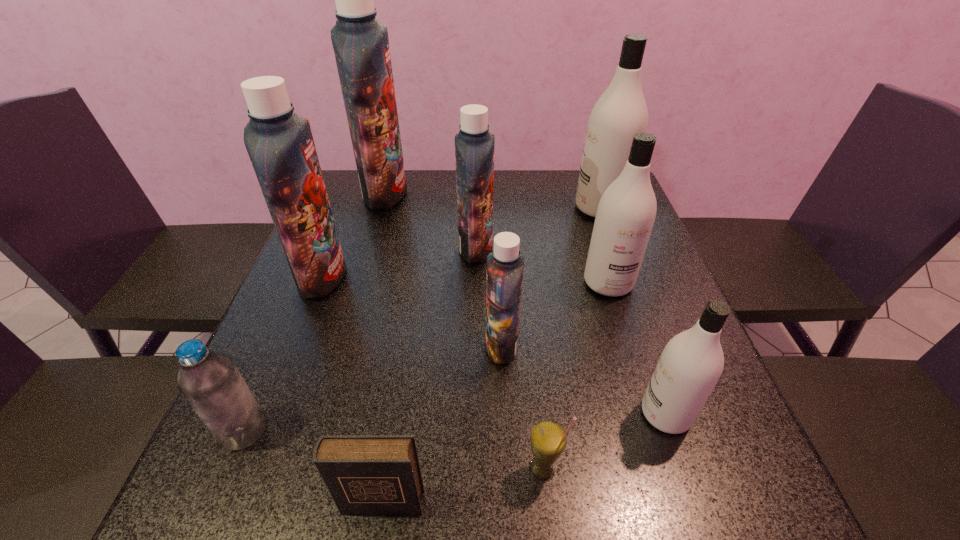
Where is `blue shampoo that is the third nearest to the farthest white shampoo`? This screenshot has width=960, height=540. blue shampoo that is the third nearest to the farthest white shampoo is located at coordinates [x=361, y=45].

Identify which white shampoo is located as the nearest to the nearest shampoo. Please provide its 2D coordinates. Your answer should be formatted as a tuple, i.e. [(x, y)], where the tuple contains the x and y coordinates of a point satisfying the conditions above.

[(626, 212)]

Where is `white shampoo object that ranks as the third closest to the third biggest blue shampoo`? This screenshot has height=540, width=960. white shampoo object that ranks as the third closest to the third biggest blue shampoo is located at coordinates (691, 363).

What are the coordinates of `blank space that satisfies the following two spatial constraints: 1. on the front-facing side of the farthest white shampoo; 2. on the front side of the water bottle` in the screenshot? It's located at (682, 430).

The width and height of the screenshot is (960, 540). What are the coordinates of `free space in the image that satisfies the following two spatial constraints: 1. on the front label of the third biggest blue shampoo; 2. on the front cover of the seventh object from right to left` in the screenshot? It's located at (472, 502).

Where is `free space that satisfies the following two spatial constraints: 1. on the front-facing side of the biggest white shampoo; 2. on the front side of the water bottle`? This screenshot has width=960, height=540. free space that satisfies the following two spatial constraints: 1. on the front-facing side of the biggest white shampoo; 2. on the front side of the water bottle is located at coordinates (682, 430).

Where is `vacant position in the image that satisfies the following two spatial constraints: 1. on the front-facing side of the farthest white shampoo; 2. on the front side of the water bottle`? vacant position in the image that satisfies the following two spatial constraints: 1. on the front-facing side of the farthest white shampoo; 2. on the front side of the water bottle is located at coordinates (682, 430).

Identify the location of blank space that satisfies the following two spatial constraints: 1. on the back side of the yellow straw for drinking; 2. on the front label of the farthest blue shampoo. (514, 193).

Locate an element on the screen. vacant space that satisfies the following two spatial constraints: 1. on the front label of the straw for drinking; 2. on the right side of the farthest blue shampoo is located at coordinates point(302,469).